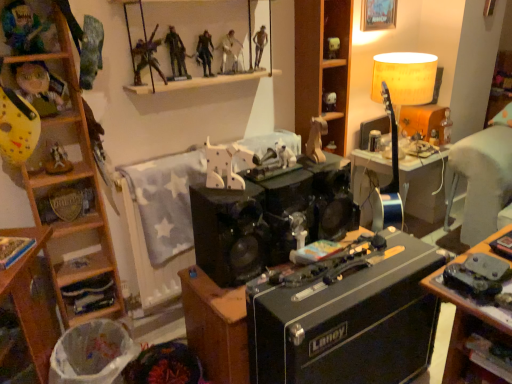
This screenshot has width=512, height=384. Identify the location of vacant region in front of wooden horse at center, which ranks as the 5th toy in top-to-bottom order. (229, 193).